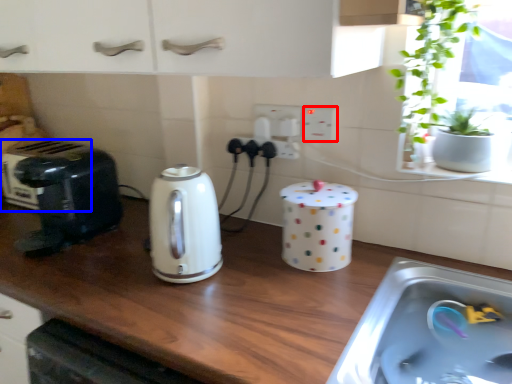
Question: Which object is closer to the camera taking this photo, electric outlet (highlighted by a red box) or appliance (highlighted by a blue box)?

Choices:
 (A) electric outlet
 (B) appliance

Answer: (A)